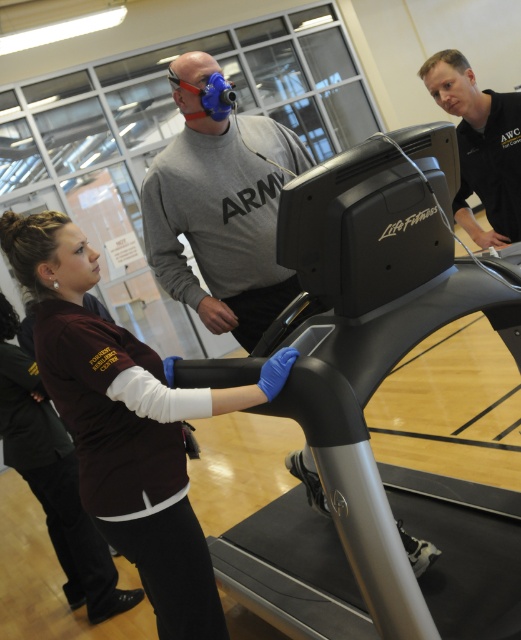
Based on the scene description, which object is positioned higher up in the image, the maroon fabric shirt at center or the black matte shirt at upper right?

The black matte shirt at upper right is positioned higher up in the image than the maroon fabric shirt at center.

You are a physical therapist in the gym. You need to move a 1.5 meters long medical equipment from the wall to the area between the black plastic treadmill at center and the gray matte sweatshirt at center. Is there enough space for the equipment?

The distance between the black plastic treadmill at center and the gray matte sweatshirt at center is 1.29 meters. Since the medical equipment is 1.5 meters long, it is longer than the available space. Therefore, there is not enough space to place the equipment between them.

You are a physical therapist planning to place a new equipment in the gym. The black plastic treadmill at center and the gray matte sweatshirt at center are currently occupying space. Which object takes up more space in the gym?

The black plastic treadmill at center has a larger size compared to the gray matte sweatshirt at center, so it takes up more space in the gym.